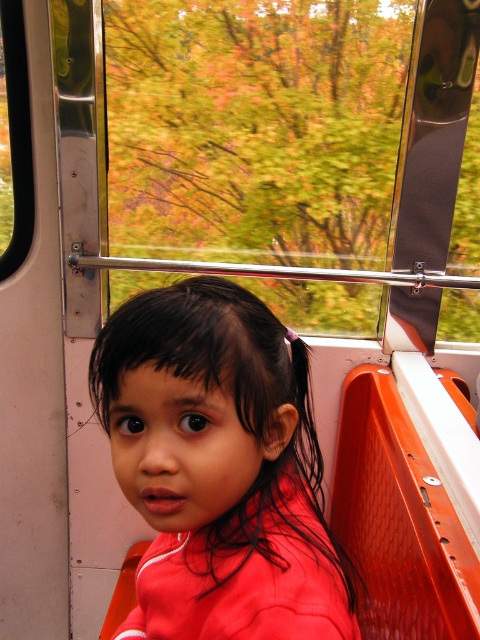
Question: Observing the image, what is the correct spatial positioning of transparent glass window at center in reference to black plastic window at upper left?

Choices:
 (A) above
 (B) below

Answer: (A)

Question: Which of the following is the closest to the observer?

Choices:
 (A) black plastic window at upper left
 (B) matte red shirt at center
 (C) transparent glass window at center

Answer: (B)

Question: Which object is positioned closest to the matte red shirt at center?

Choices:
 (A) transparent glass window at center
 (B) black plastic window at upper left

Answer: (B)

Question: Is transparent glass window at center thinner than black plastic window at upper left?

Choices:
 (A) no
 (B) yes

Answer: (A)

Question: Which object is farther from the camera taking this photo?

Choices:
 (A) black plastic window at upper left
 (B) transparent glass window at center
 (C) matte red shirt at center

Answer: (B)

Question: In this image, where is transparent glass window at center located relative to black plastic window at upper left?

Choices:
 (A) below
 (B) above

Answer: (B)